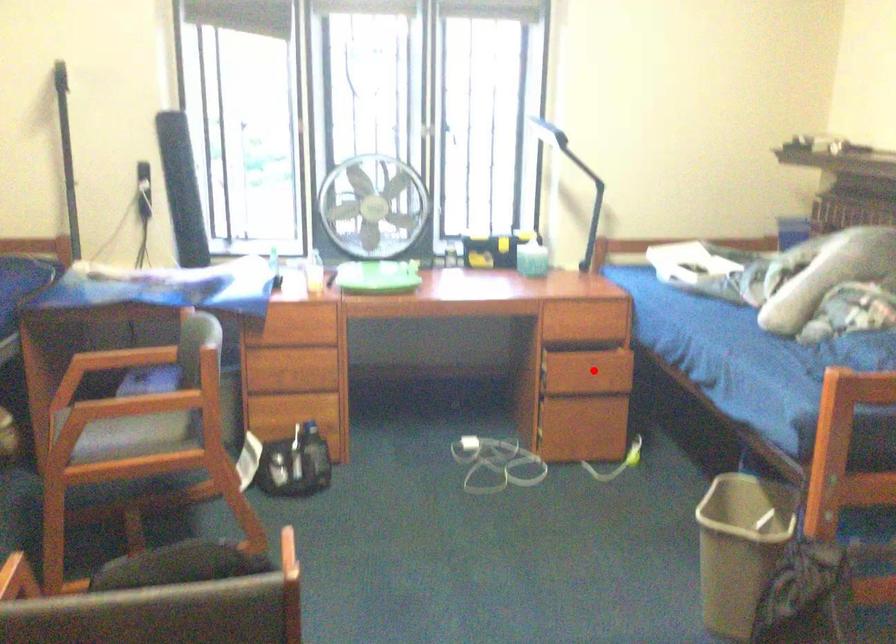
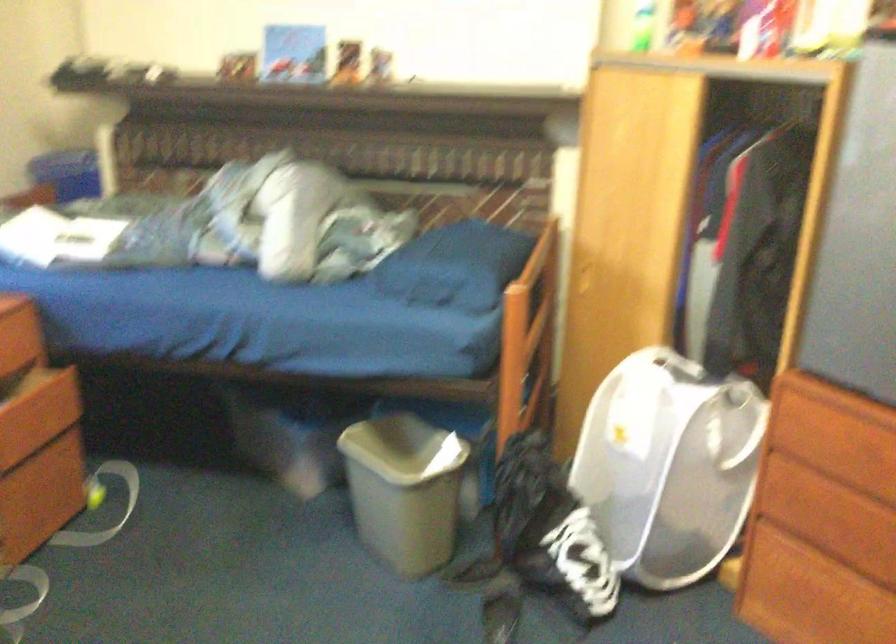
Question: I am providing you with two images of the same scene from different viewpoints. In image1, a red point is highlighted. Considering the same 3D point in image2, which of the following is correct?

Choices:
 (A) It is closer
 (B) It is farther

Answer: (A)